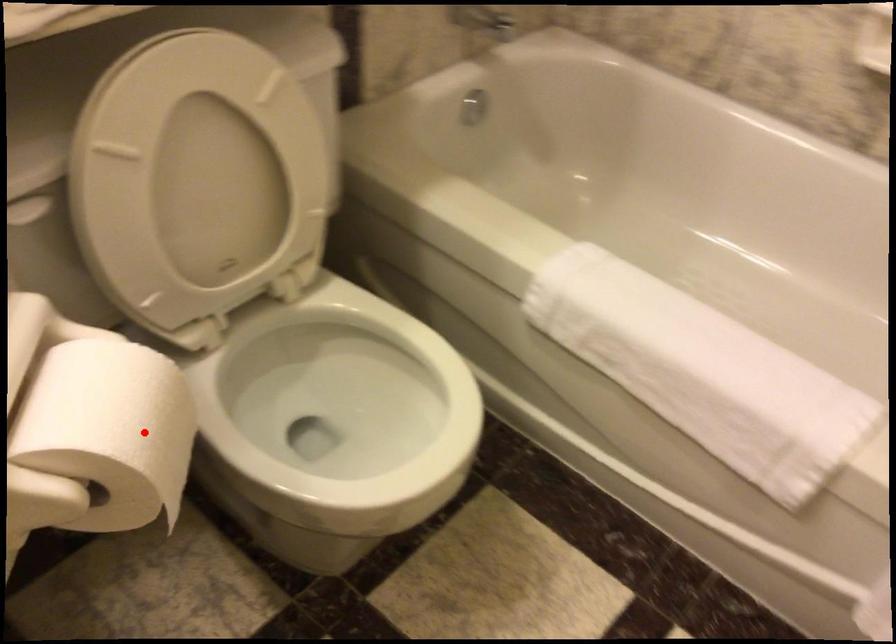
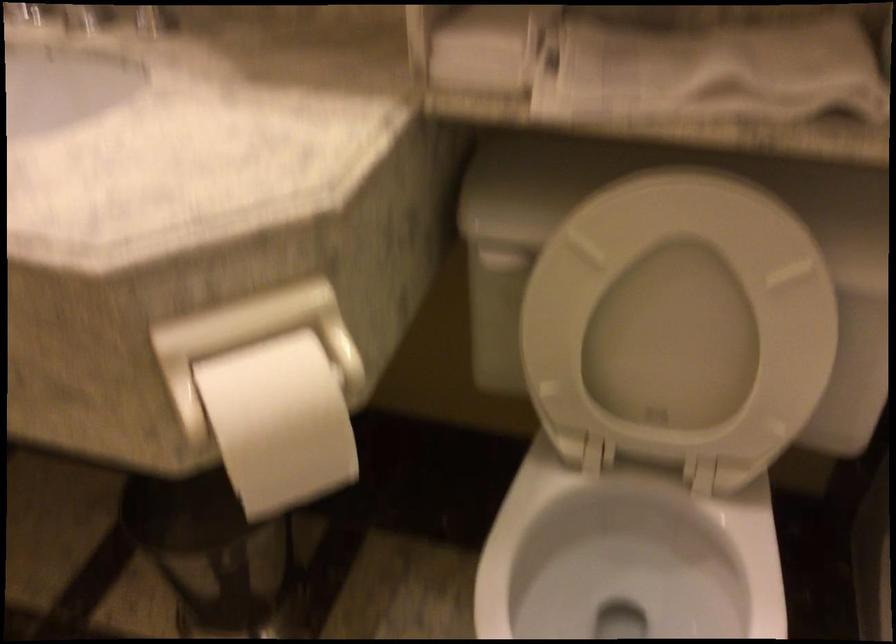
Question: I am providing you with two images of the same scene from different viewpoints. In image1, a red point is highlighted. Considering the same 3D point in image2, which of the following is correct?

Choices:
 (A) It is closer
 (B) It is farther

Answer: (B)